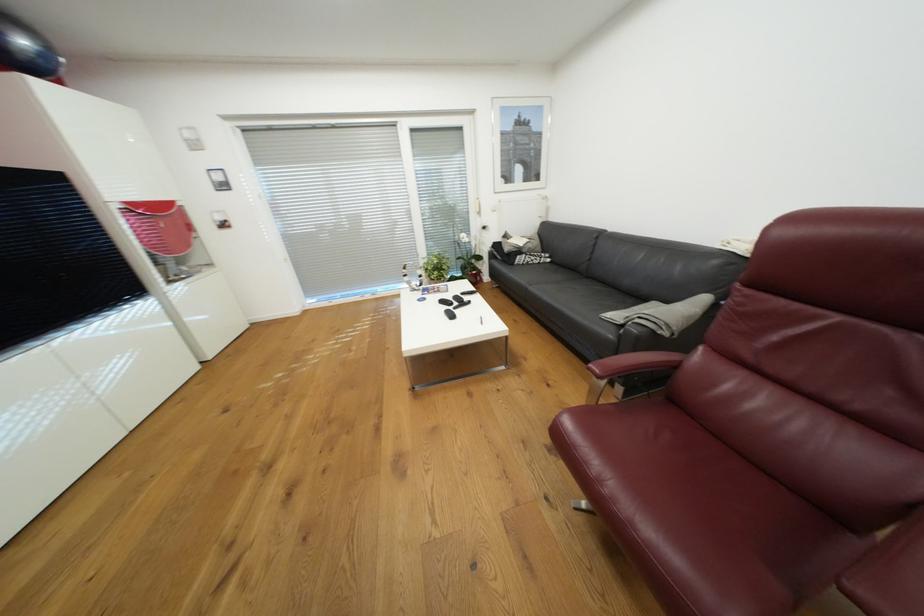
The width and height of the screenshot is (924, 616). What do you see at coordinates (633, 363) in the screenshot?
I see `the red chair armrest` at bounding box center [633, 363].